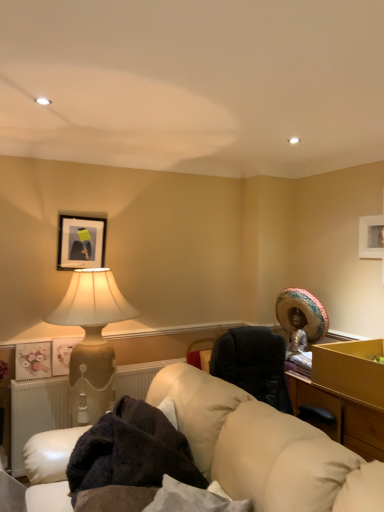
What is the approximate height of leather couch at lower center?

The height of leather couch at lower center is 99.77 centimeters.

The image size is (384, 512). What are the coordinates of `matte gold picture frame at left, which is the 2th picture frame in bottom-to-top order` in the screenshot? It's located at (62, 354).

What do you see at coordinates (33, 360) in the screenshot? The image size is (384, 512). I see `matte floral print at left, which is counted as the 3th picture frame, starting from the top` at bounding box center [33, 360].

In order to face dark brown plush blanket at lower center, should I rotate leftwards or rightwards?

Turn left approximately 7.018 degrees to face it.

What do you see at coordinates (131, 451) in the screenshot? I see `dark brown plush blanket at lower center` at bounding box center [131, 451].

Describe the element at coordinates (81, 242) in the screenshot. I see `matte black picture frame at upper left, placed as the 3th picture frame when sorted from bottom to top` at that location.

Describe the element at coordinates (91, 340) in the screenshot. I see `matte beige lamp at left` at that location.

This screenshot has width=384, height=512. Identify the location of leather couch at lower center. (263, 448).

Would you say matte gold picture frame at left, which is the 2th picture frame in bottom-to-top order, is to the left or to the right of leather couch at lower center in the picture?

Clearly, matte gold picture frame at left, which is the 2th picture frame in bottom-to-top order, is on the left of leather couch at lower center in the image.

Between matte gold picture frame at left, which is the 2th picture frame in bottom-to-top order, and leather couch at lower center, which one has less height?

Standing shorter between the two is matte gold picture frame at left, which is the 2th picture frame in bottom-to-top order.

Between point (55, 362) and point (273, 473), which one is positioned in front?

Point (273, 473)

Is matte gold picture frame at left, which is the 2th picture frame in bottom-to-top order, oriented towards leather couch at lower center?

Yes, matte gold picture frame at left, which is the 2th picture frame in bottom-to-top order, faces towards leather couch at lower center.

How much distance is there between white radiator at lower left and dark brown plush blanket at lower center?

The distance of white radiator at lower left from dark brown plush blanket at lower center is 35.00 inches.

Can you confirm if white radiator at lower left is taller than dark brown plush blanket at lower center?

Indeed, white radiator at lower left has a greater height compared to dark brown plush blanket at lower center.

Is white radiator at lower left positioned with its back to dark brown plush blanket at lower center?

No, white radiator at lower left is not facing away from dark brown plush blanket at lower center.

Between white radiator at lower left and dark brown plush blanket at lower center, which one is positioned behind?

white radiator at lower left is further from the camera.

Is dark brown plush blanket at lower center facing away from matte black picture frame at upper left, the 1th picture frame positioned from the top?

dark brown plush blanket at lower center is not turned away from matte black picture frame at upper left, the 1th picture frame positioned from the top.

At what (x,y) coordinates should I click in order to perform the action: click on the 3rd picture frame above the dark brown plush blanket at lower center (from the image's perspective). Please return your answer as a coordinate pair (x, y). The image size is (384, 512). Looking at the image, I should click on (81, 242).

Is dark brown plush blanket at lower center in front of or behind matte black picture frame at upper left, placed as the 3th picture frame when sorted from bottom to top, in the image?

In the image, dark brown plush blanket at lower center appears in front of matte black picture frame at upper left, placed as the 3th picture frame when sorted from bottom to top.

Between matte black picture frame at upper left, placed as the 3th picture frame when sorted from bottom to top, and leather couch at lower center, which one has larger width?

leather couch at lower center.

From the picture: Which object is more forward, matte black picture frame at upper left, placed as the 3th picture frame when sorted from bottom to top, or leather couch at lower center?

Positioned in front is leather couch at lower center.

Is matte black picture frame at upper left, placed as the 3th picture frame when sorted from bottom to top, taller or shorter than leather couch at lower center?

matte black picture frame at upper left, placed as the 3th picture frame when sorted from bottom to top, is shorter than leather couch at lower center.

Could you tell me if matte black picture frame at upper left, the 1th picture frame positioned from the top, is facing leather couch at lower center?

No, matte black picture frame at upper left, the 1th picture frame positioned from the top, is not facing towards leather couch at lower center.

Is point (59, 364) farther from camera compared to point (42, 375)?

Yes, it is.

Between matte gold picture frame at left, which is the 2th picture frame in bottom-to-top order, and matte floral print at left, which appears as the 1th picture frame when ordered from the bottom, which one appears on the left side from the viewer's perspective?

Positioned to the left is matte floral print at left, which appears as the 1th picture frame when ordered from the bottom.

What's the angular difference between matte gold picture frame at left, which ranks as the second picture frame in top-to-bottom order, and matte floral print at left, which is counted as the 3th picture frame, starting from the top,'s facing directions?

There is a 7.64e-05-degree angle between the facing directions of matte gold picture frame at left, which ranks as the second picture frame in top-to-bottom order, and matte floral print at left, which is counted as the 3th picture frame, starting from the top.

Is matte gold picture frame at left, which is the 2th picture frame in bottom-to-top order, far from matte floral print at left, which is counted as the 3th picture frame, starting from the top?

matte gold picture frame at left, which is the 2th picture frame in bottom-to-top order, is near matte floral print at left, which is counted as the 3th picture frame, starting from the top, not far away.

Considering the relative positions of dark brown plush blanket at lower center and white radiator at lower left in the image provided, is dark brown plush blanket at lower center to the right of white radiator at lower left from the viewer's perspective?

Yes.

Does point (166, 466) appear closer or farther from the camera than point (147, 378)?

Clearly, point (166, 466) is closer to the camera than point (147, 378).

In terms of width, does dark brown plush blanket at lower center look wider or thinner when compared to white radiator at lower left?

In the image, dark brown plush blanket at lower center appears to be wider than white radiator at lower left.

Which of these two, dark brown plush blanket at lower center or white radiator at lower left, stands taller?

Standing taller between the two is white radiator at lower left.

Can you confirm if matte beige lamp at left is bigger than white radiator at lower left?

Indeed, matte beige lamp at left has a larger size compared to white radiator at lower left.

Is matte beige lamp at left to the left or to the right of white radiator at lower left in the image?

matte beige lamp at left is positioned on white radiator at lower left's left side.

From the image's perspective, is matte beige lamp at left over white radiator at lower left?

Correct, matte beige lamp at left appears higher than white radiator at lower left in the image.

Is matte beige lamp at left in front of or behind white radiator at lower left in the image?

Visually, matte beige lamp at left is located in front of white radiator at lower left.

You are a GUI agent. You are given a task and a screenshot of the screen. Output one action in this format:
    pyautogui.click(x=<x>, y=<y>)
    Task: Click on the studio couch located on the right of matte gold picture frame at left, which ranks as the second picture frame in top-to-bottom order
    The width and height of the screenshot is (384, 512).
    Given the screenshot: What is the action you would take?
    pyautogui.click(x=263, y=448)

Where is `radiator located underneath the dark brown plush blanket at lower center (from a real-world perspective)`? The width and height of the screenshot is (384, 512). radiator located underneath the dark brown plush blanket at lower center (from a real-world perspective) is located at coordinates (36, 413).

Estimate the real-world distances between objects in this image. Which object is further from leather couch at lower center, matte floral print at left, which appears as the 1th picture frame when ordered from the bottom, or matte black picture frame at upper left, placed as the 3th picture frame when sorted from bottom to top?

matte black picture frame at upper left, placed as the 3th picture frame when sorted from bottom to top, lies further to leather couch at lower center than the other object.

Considering their positions, is dark brown plush blanket at lower center positioned closer to matte floral print at left, which is counted as the 3th picture frame, starting from the top, than white radiator at lower left?

Among the two, white radiator at lower left is located nearer to matte floral print at left, which is counted as the 3th picture frame, starting from the top.

Based on the photo, based on their spatial positions, is matte black picture frame at upper left, placed as the 3th picture frame when sorted from bottom to top, or matte gold picture frame at left, which ranks as the second picture frame in top-to-bottom order, closer to leather couch at lower center?

matte gold picture frame at left, which ranks as the second picture frame in top-to-bottom order, is positioned closer to the anchor leather couch at lower center.

Considering their positions, is leather couch at lower center positioned further to matte gold picture frame at left, which ranks as the second picture frame in top-to-bottom order, than matte black picture frame at upper left, the 1th picture frame positioned from the top?

Based on the image, leather couch at lower center appears to be further to matte gold picture frame at left, which ranks as the second picture frame in top-to-bottom order.

Considering their positions, is matte black picture frame at upper left, the 1th picture frame positioned from the top, positioned further to leather couch at lower center than white radiator at lower left?

matte black picture frame at upper left, the 1th picture frame positioned from the top, is further to leather couch at lower center.

Considering their positions, is dark brown plush blanket at lower center positioned closer to matte beige lamp at left than leather couch at lower center?

The object closer to matte beige lamp at left is dark brown plush blanket at lower center.

From the picture: Considering their positions, is dark brown plush blanket at lower center positioned further to white radiator at lower left than matte gold picture frame at left, which ranks as the second picture frame in top-to-bottom order?

dark brown plush blanket at lower center is further to white radiator at lower left.

From the image, which object appears to be nearer to leather couch at lower center, matte gold picture frame at left, which ranks as the second picture frame in top-to-bottom order, or matte beige lamp at left?

matte beige lamp at left is closer to leather couch at lower center.

The height and width of the screenshot is (512, 384). Identify the location of lamp between matte black picture frame at upper left, placed as the 3th picture frame when sorted from bottom to top, and white radiator at lower left, in the vertical direction. (91, 340).

Locate an element on the screen. The width and height of the screenshot is (384, 512). blanket between leather couch at lower center and matte beige lamp at left along the z-axis is located at coordinates (131, 451).

You are a GUI agent. You are given a task and a screenshot of the screen. Output one action in this format:
    pyautogui.click(x=<x>, y=<y>)
    Task: Click on the lamp positioned between leather couch at lower center and white radiator at lower left from near to far
    The height and width of the screenshot is (512, 384).
    Given the screenshot: What is the action you would take?
    pyautogui.click(x=91, y=340)

Where is `lamp between dark brown plush blanket at lower center and white radiator at lower left in the front-back direction`? lamp between dark brown plush blanket at lower center and white radiator at lower left in the front-back direction is located at coordinates pyautogui.click(x=91, y=340).